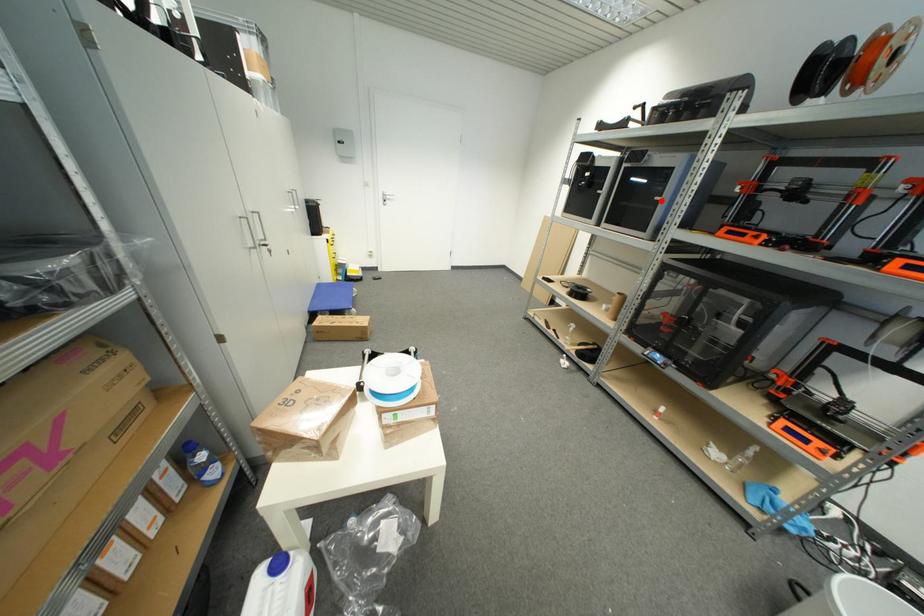
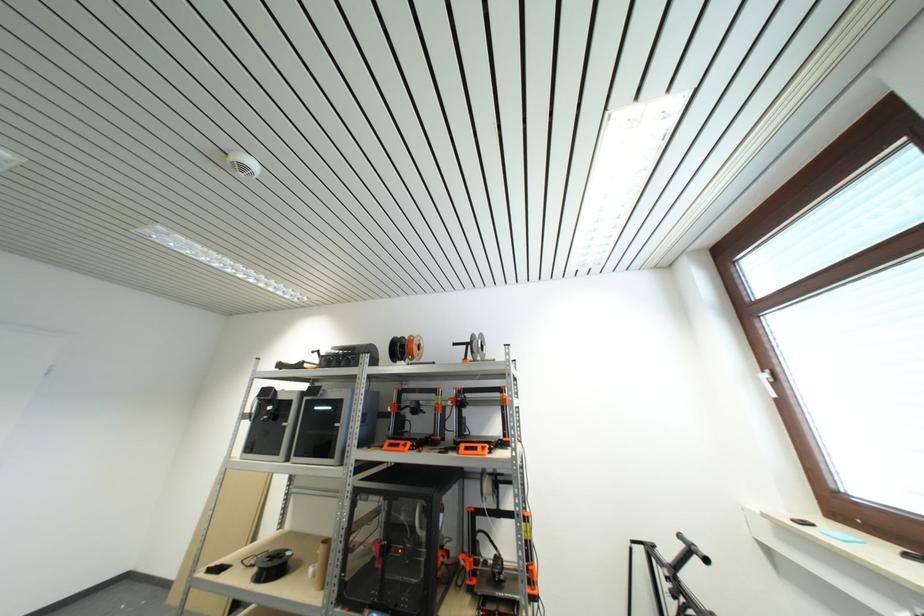
Question: I am providing you with two images of the same scene from different viewpoints. A red point is shown in image1. For the corresponding object point in image2, is it positioned nearer or farther from the camera?

Choices:
 (A) Nearer
 (B) Farther

Answer: (B)